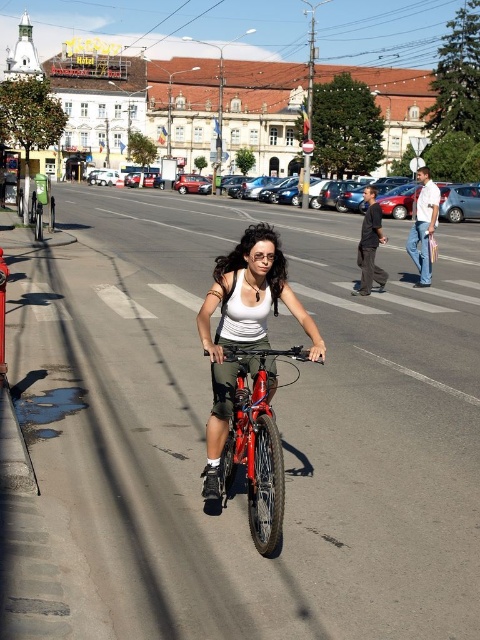
You are a delivery person standing at the crosswalk on the left side of the road. You need to place a package at the point marked as point (x=218, y=337). Can you reach that point without crossing the road?

The point (x=218, y=337) is 4.55 meters from the viewer. Since the crosswalk is on the left side of the road and the point is located on the same side as the crosswalk, you can reach it without crossing the road.

You are a fashion designer analyzing the image. You need to locate the matte white tank top at center. What are its coordinates?

The matte white tank top at center is located at coordinates point (243, 326).